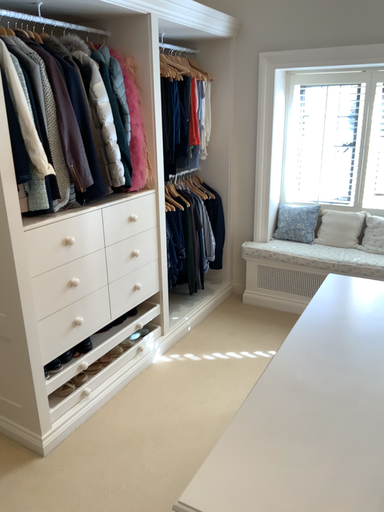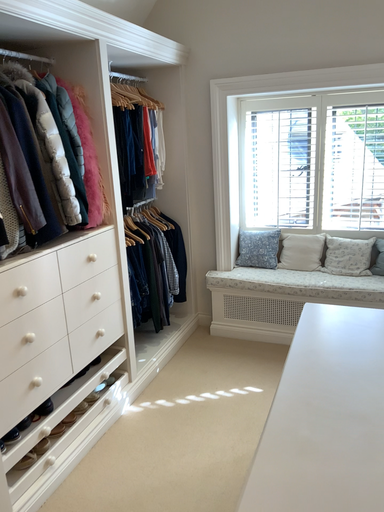
Question: How did the camera likely rotate when shooting the video?

Choices:
 (A) rotated left
 (B) rotated right

Answer: (B)